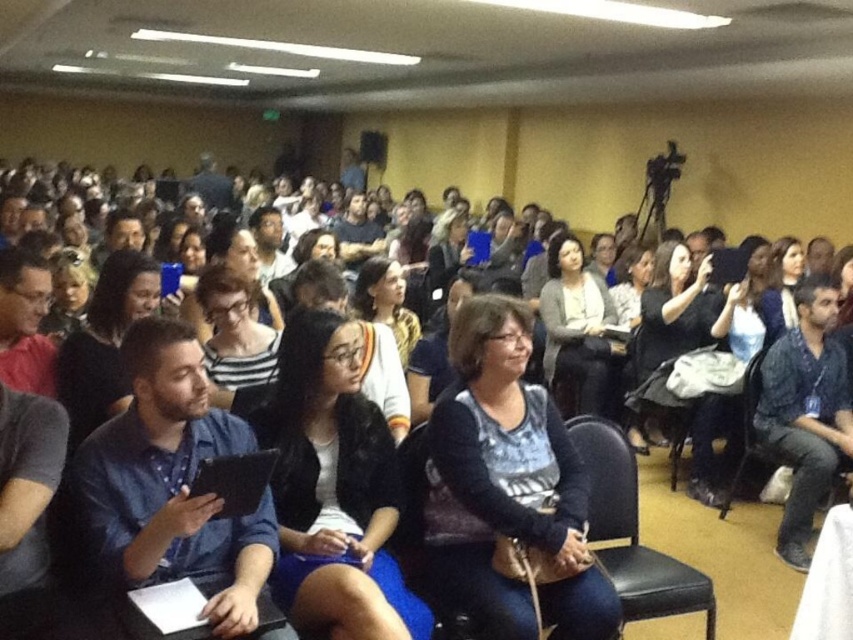
You are organizing a photo shoot and need to arrange the blue denim shirt at right and the matte black shirt at left in a row. Based on their widths, which shirt should be placed first to ensure they fit within a 1.5 meter wide space?

The matte black shirt at left is narrower than the blue denim shirt at right. To fit within the 1.5 meter space, place the narrower matte black shirt at left first, followed by the wider blue denim shirt at right.

In the scene shown: You are a conference attendee who needs to pass between the blue denim shirt at right and the matte black shirt at left to reach the exit. Can you walk through the space between them without needing to move either person?

The distance between the blue denim shirt at right and matte black shirt at left is 3.24 meters, so yes, you can walk through the space between them easily since the distance is more than enough for a person to pass through.

You are an event planner standing at the front of the room and need to hand out a document to the person wearing the blue denim shirt at right and the person sitting in the black leather chair at center. If you can only walk 5 feet to deliver both documents, can you reach both people without exceeding your walking limit?

The blue denim shirt at right is 4.85 feet away from the black leather chair at center. Since the distance between them is less than 5 feet, you can walk to one, then the other, staying within the 5 feet limit.